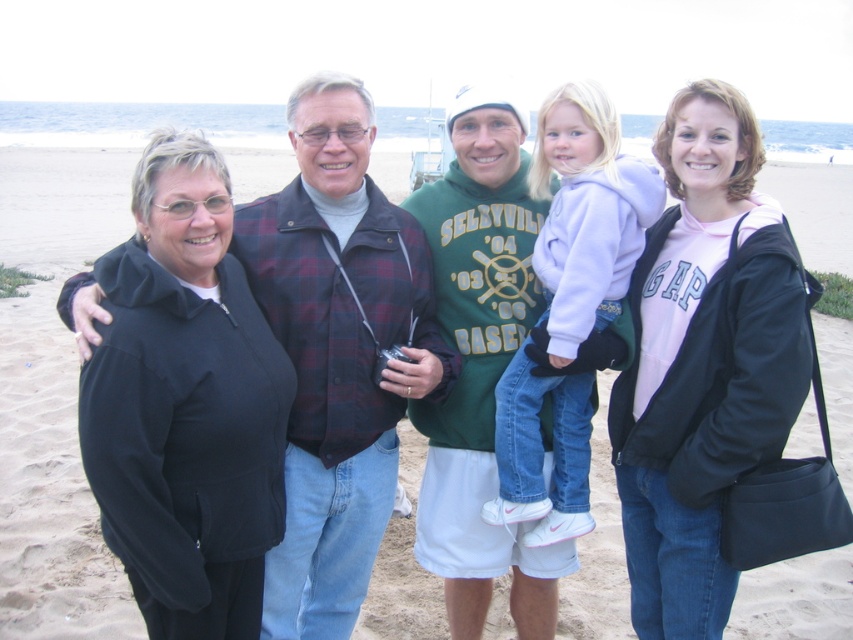
You are a photographer trying to capture a clear shot of the black fleece jacket at left and the black fabric jacket at center. Since both jackets are black, you need to adjust your camera settings to account for their positions. Which jacket is closer to the camera?

The black fleece jacket at left is in front of the black fabric jacket at center, so it is closer to the camera.